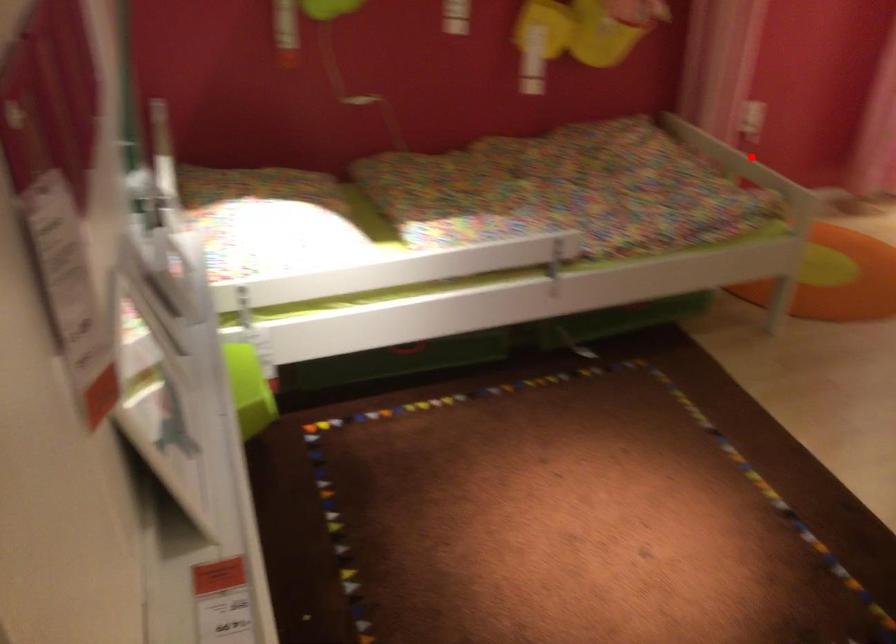
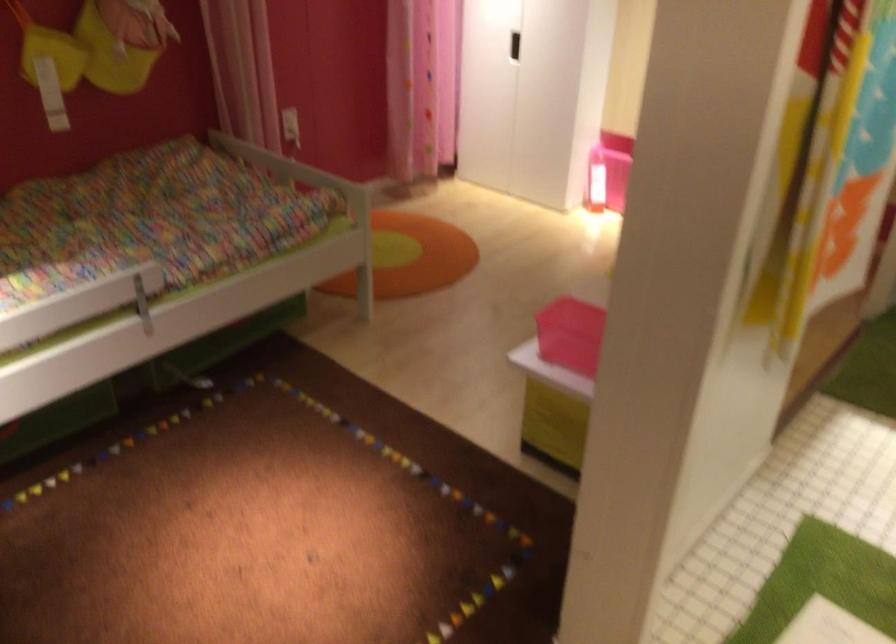
The point at the highlighted location is marked in the first image. Where is the corresponding point in the second image?

(297, 172)